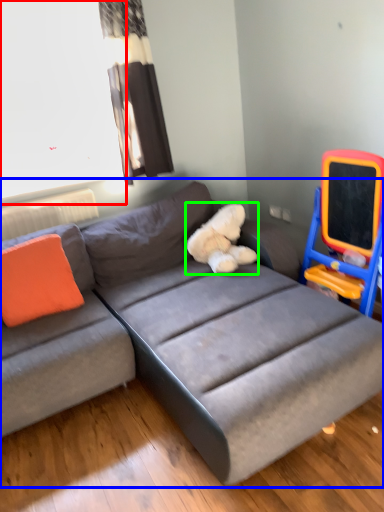
Question: Which object is the closest to the window screen (highlighted by a red box)? Choose among these: studio couch (highlighted by a blue box) or teddy (highlighted by a green box).

Choices:
 (A) studio couch
 (B) teddy

Answer: (A)